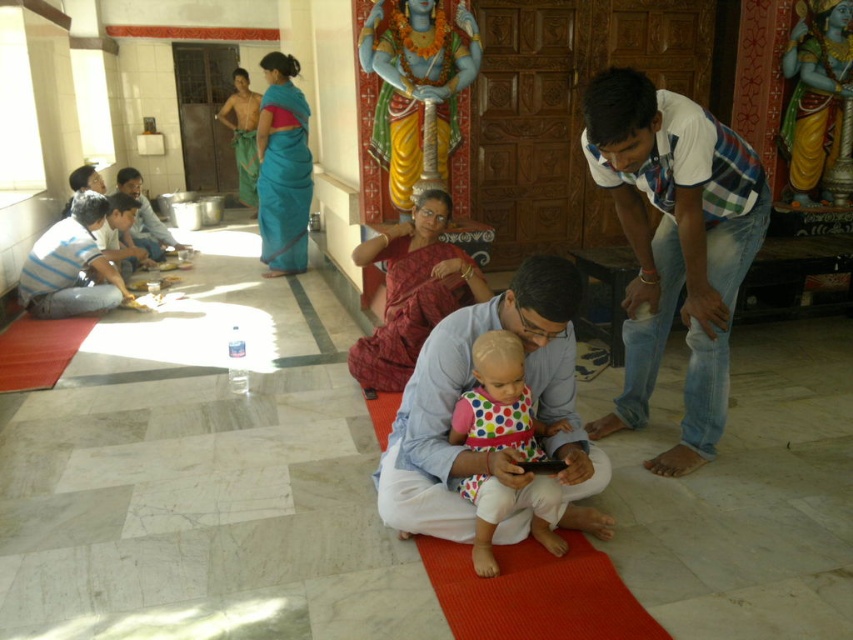
You are a photographer planning to take a group photo of the people in the temple scene. You need to arrange them so that everyone is visible. Given that the matte blue shirt at center and the teal silk saree at center are both at the center, which one should you position slightly forward to ensure both are visible?

The matte blue shirt at center is shorter than the teal silk saree at center, so you should position the matte blue shirt at center slightly forward to ensure both are visible.

You are standing at the entrance of the temple and want to place a new decorative item exactly at the center of the room. The red silk saree at center is currently occupying a specific location. Can you determine if the saree is positioned at the exact center of the room based on its coordinates?

The red silk saree at center is located at point (412, 291), which is very close to the exact center of the room. Since the coordinates are nearly 0.5 in both x and y axes, it can be considered as being at the center.

You are a visitor in the temple and want to take a photo of the red silk saree at center without the teal silk saree at upper center appearing in the background. Based on their positions, is this possible?

The red silk saree at center is in front of the teal silk saree at upper center, so you can position yourself so that the red silk saree at center blocks the view of the teal silk saree at upper center, making it possible to take a photo without the teal silk saree at upper center in the background.